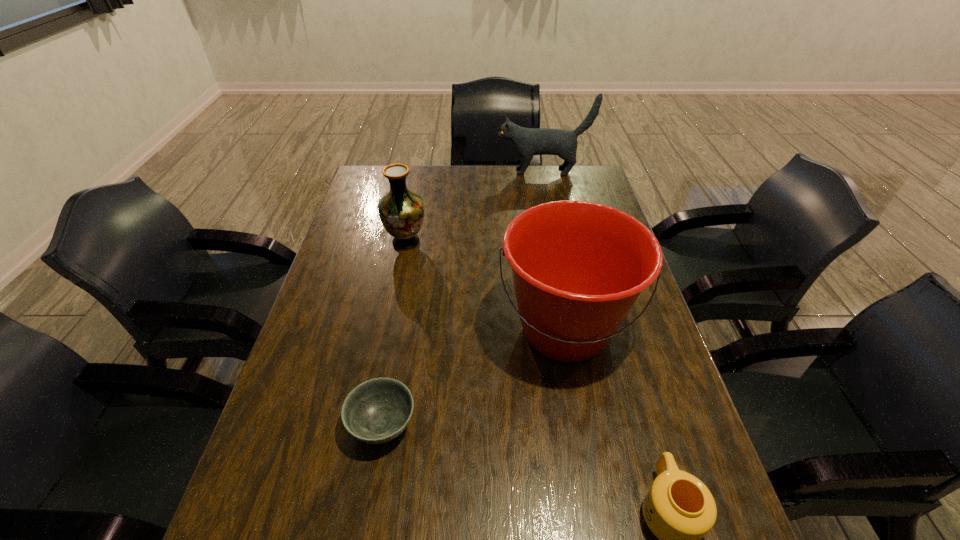
Where is `cat`? This screenshot has height=540, width=960. cat is located at coordinates (527, 142).

You are a GUI agent. You are given a task and a screenshot of the screen. Output one action in this format:
    pyautogui.click(x=<x>, y=<y>)
    Task: Click on the bucket
    The width and height of the screenshot is (960, 540).
    Given the screenshot: What is the action you would take?
    pyautogui.click(x=578, y=267)

Locate an element on the screen. the fourth nearest object is located at coordinates (401, 211).

This screenshot has width=960, height=540. Find the location of `the shortest object`. the shortest object is located at coordinates (376, 411).

The image size is (960, 540). Find the location of `the second nearest object`. the second nearest object is located at coordinates (376, 411).

Identify the location of vacant space located at the face of the farthest object. (454, 172).

Where is `free space located 0.090m at the face of the farthest object`? This screenshot has width=960, height=540. free space located 0.090m at the face of the farthest object is located at coordinates (474, 172).

Identify the location of free space located 0.090m at the face of the farthest object. (474, 172).

Where is `free space located with the handle attached to the rim of the third nearest object`? free space located with the handle attached to the rim of the third nearest object is located at coordinates (589, 468).

Identify the location of vacant space located on the left of the vase. (345, 242).